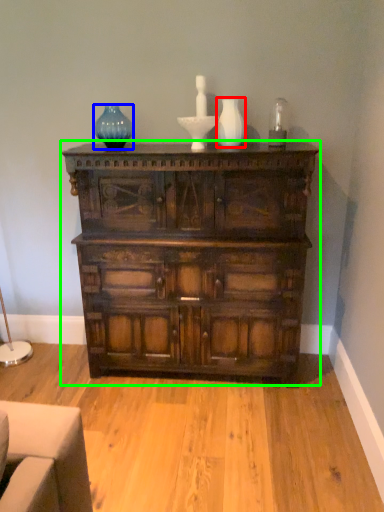
Question: Which object is the farthest from vase (highlighted by a red box)? Choose among these: glass vase (highlighted by a blue box) or chest of drawers (highlighted by a green box).

Choices:
 (A) glass vase
 (B) chest of drawers

Answer: (B)